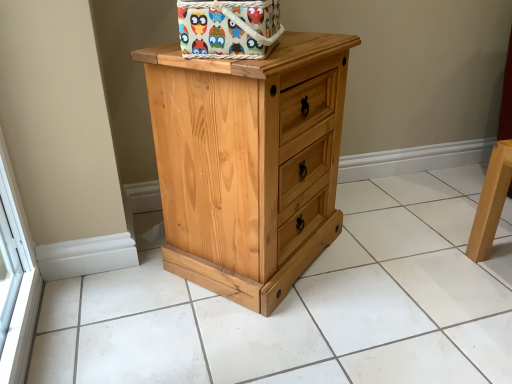
Find the location of `natural wood chest of drawers at center`. natural wood chest of drawers at center is located at coordinates click(249, 163).

At what (x,y) coordinates should I click in order to perform the action: click on multicolored fabric basket at top center. Please return your answer as a coordinate pair (x, y). Looking at the image, I should click on (228, 28).

Is natural wood cabinet at center positioned with its back to natural wood chest of drawers at center?

Yes, natural wood cabinet at center is facing away from natural wood chest of drawers at center.

Is natural wood cabinet at center to the left or to the right of natural wood chest of drawers at center in the image?

From the image, it's evident that natural wood cabinet at center is to the right of natural wood chest of drawers at center.

Locate an element on the screen. chest of drawers above the natural wood cabinet at center (from a real-world perspective) is located at coordinates (249, 163).

From the image's perspective, which one is positioned higher, natural wood chest of drawers at center or natural wood cabinet at center?

natural wood chest of drawers at center is shown above in the image.

Is natural wood chest of drawers at center in front of or behind natural wood cabinet at center in the image?

natural wood chest of drawers at center is positioned farther from the viewer than natural wood cabinet at center.

From their relative heights in the image, would you say natural wood chest of drawers at center is taller or shorter than natural wood cabinet at center?

Clearly, natural wood chest of drawers at center is taller compared to natural wood cabinet at center.

In the scene shown: Is natural wood chest of drawers at center situated inside natural wood cabinet at center or outside?

natural wood chest of drawers at center cannot be found inside natural wood cabinet at center.

Is the surface of natural wood chest of drawers at center in direct contact with multicolored fabric basket at top center?

There is a gap between natural wood chest of drawers at center and multicolored fabric basket at top center.

Which point is more forward, (233, 295) or (220, 13)?

Positioned in front is point (220, 13).

From the picture: Considering the sizes of objects natural wood chest of drawers at center and multicolored fabric basket at top center in the image provided, who is bigger, natural wood chest of drawers at center or multicolored fabric basket at top center?

Bigger between the two is natural wood chest of drawers at center.

Based on the photo, is there a large distance between multicolored fabric basket at top center and natural wood cabinet at center?

No, there isn't a large distance between multicolored fabric basket at top center and natural wood cabinet at center.

Considering their positions, is multicolored fabric basket at top center located in front of or behind natural wood cabinet at center?

multicolored fabric basket at top center is behind natural wood cabinet at center.

Considering the relative sizes of multicolored fabric basket at top center and natural wood cabinet at center in the image provided, is multicolored fabric basket at top center bigger than natural wood cabinet at center?

No.

Does multicolored fabric basket at top center turn towards natural wood cabinet at center?

No, multicolored fabric basket at top center does not turn towards natural wood cabinet at center.

Who is smaller, natural wood cabinet at center or multicolored fabric basket at top center?

With smaller size is multicolored fabric basket at top center.

Could you tell me if natural wood cabinet at center is turned towards multicolored fabric basket at top center?

No, natural wood cabinet at center is not turned towards multicolored fabric basket at top center.

Does natural wood cabinet at center come behind multicolored fabric basket at top center?

No, it is not.

From the image's perspective, does natural wood cabinet at center appear lower than multicolored fabric basket at top center?

Yes, from the image's perspective, natural wood cabinet at center is below multicolored fabric basket at top center.

Is multicolored fabric basket at top center shorter than natural wood chest of drawers at center?

Yes, multicolored fabric basket at top center is shorter than natural wood chest of drawers at center.

Is natural wood chest of drawers at center inside multicolored fabric basket at top center?

Actually, natural wood chest of drawers at center is outside multicolored fabric basket at top center.

Considering the relative positions of multicolored fabric basket at top center and natural wood chest of drawers at center in the image provided, is multicolored fabric basket at top center in front of natural wood chest of drawers at center?

Yes, it is.

This screenshot has height=384, width=512. I want to click on the chest of drawers behind the natural wood cabinet at center, so click(249, 163).

You are a GUI agent. You are given a task and a screenshot of the screen. Output one action in this format:
    pyautogui.click(x=<x>, y=<y>)
    Task: Click on the tile to the right of natural wood chest of drawers at center
    Image resolution: width=512 pixels, height=384 pixels.
    Given the screenshot: What is the action you would take?
    pyautogui.click(x=308, y=305)

From the image, which object appears to be nearer to natural wood chest of drawers at center, multicolored fabric basket at top center or natural wood cabinet at center?

multicolored fabric basket at top center.

Looking at the image, which one is located closer to multicolored fabric basket at top center, natural wood cabinet at center or natural wood chest of drawers at center?

The object closer to multicolored fabric basket at top center is natural wood chest of drawers at center.

Estimate the real-world distances between objects in this image. Which object is closer to multicolored fabric basket at top center, natural wood chest of drawers at center or natural wood cabinet at center?

natural wood chest of drawers at center is positioned closer to the anchor multicolored fabric basket at top center.

Which object lies further to the anchor point natural wood cabinet at center, natural wood chest of drawers at center or multicolored fabric basket at top center?

Based on the image, multicolored fabric basket at top center appears to be further to natural wood cabinet at center.

When comparing their distances from natural wood cabinet at center, does multicolored fabric basket at top center or natural wood chest of drawers at center seem further?

multicolored fabric basket at top center is positioned further to the anchor natural wood cabinet at center.

Considering their positions, is natural wood cabinet at center positioned closer to natural wood chest of drawers at center than multicolored fabric basket at top center?

multicolored fabric basket at top center is positioned closer to the anchor natural wood chest of drawers at center.

At what (x,y) coordinates should I click in order to perform the action: click on chest of drawers between multicolored fabric basket at top center and natural wood cabinet at center in the vertical direction. Please return your answer as a coordinate pair (x, y). The image size is (512, 384). Looking at the image, I should click on (249, 163).